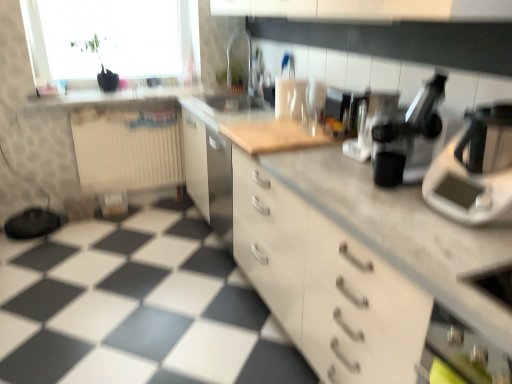
Find the location of a particular element. Image resolution: width=512 pixels, height=384 pixels. vacant space underneath beige ribbed radiator at left (from a real-world perspective) is located at coordinates (153, 195).